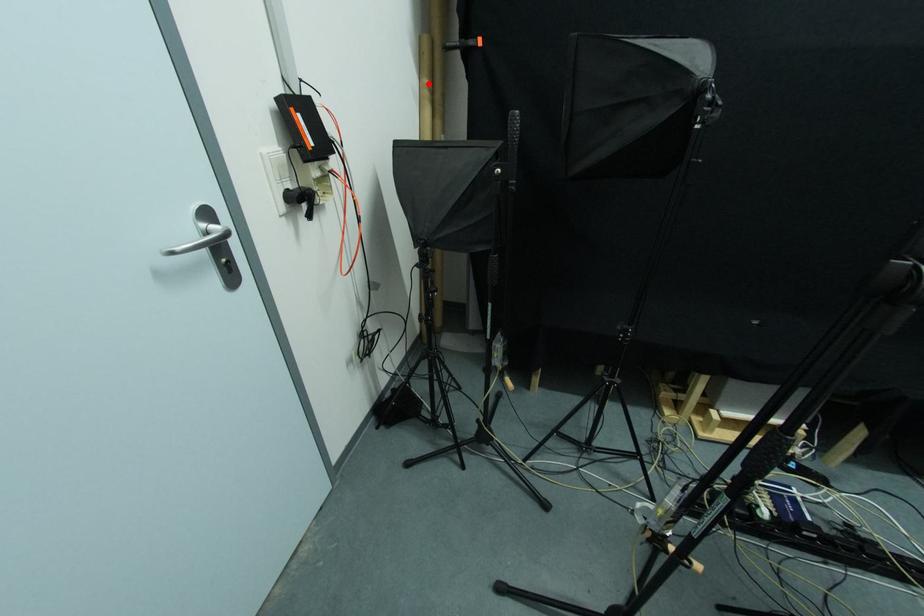
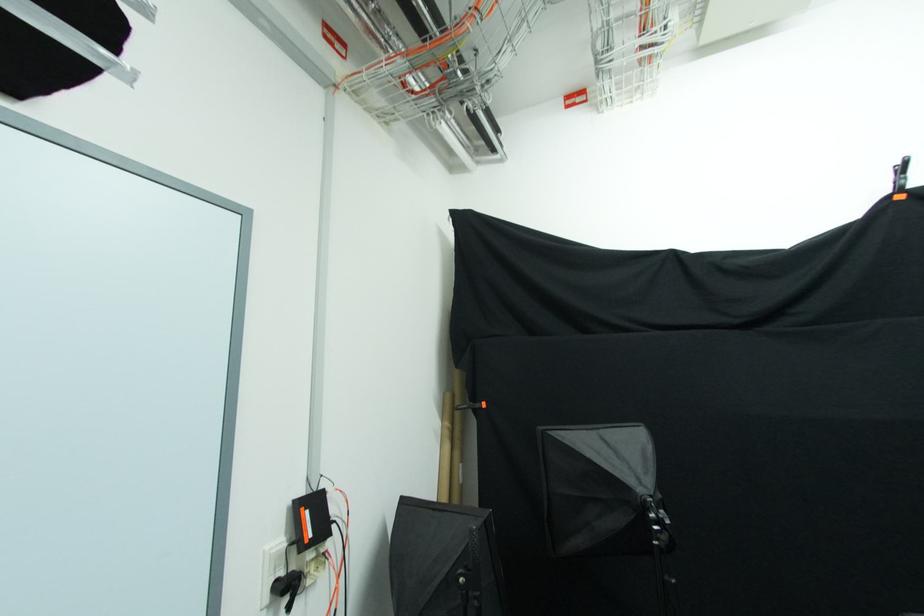
Question: A red point is marked in image1. In image2, is the corresponding 3D point closer to the camera or farther? Reply with the corresponding letter.

Choices:
 (A) The corresponding 3D point is closer.
 (B) The corresponding 3D point is farther.

Answer: (B)